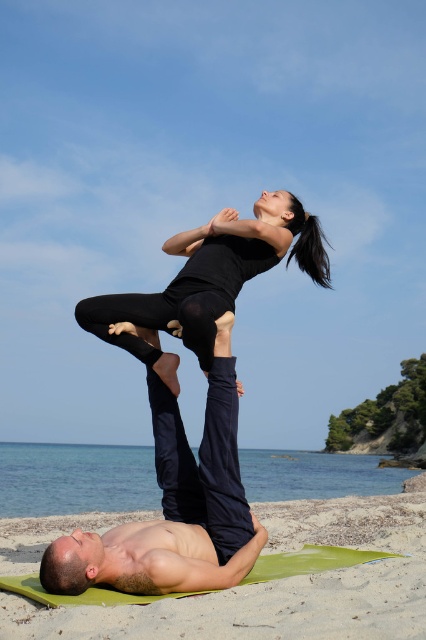
Looking at this image, you are a photographer trying to capture the acro pose of the two people. You notice the smooth black pants at center and the black matte yoga pants at upper center. Which of these two items is positioned higher in the image?

The black matte yoga pants at upper center are positioned higher in the image than the smooth black pants at center.

You are standing on the beach and want to take a photo of the black matte yoga pants at upper center without the sandy beach at lower center appearing in the frame. Is this possible given their positions?

The sandy beach at lower center is in front of the black matte yoga pants at upper center, so the beach would block the view of the pants. Therefore, it is not possible to capture the black matte yoga pants at upper center without the sandy beach at lower center in the frame.